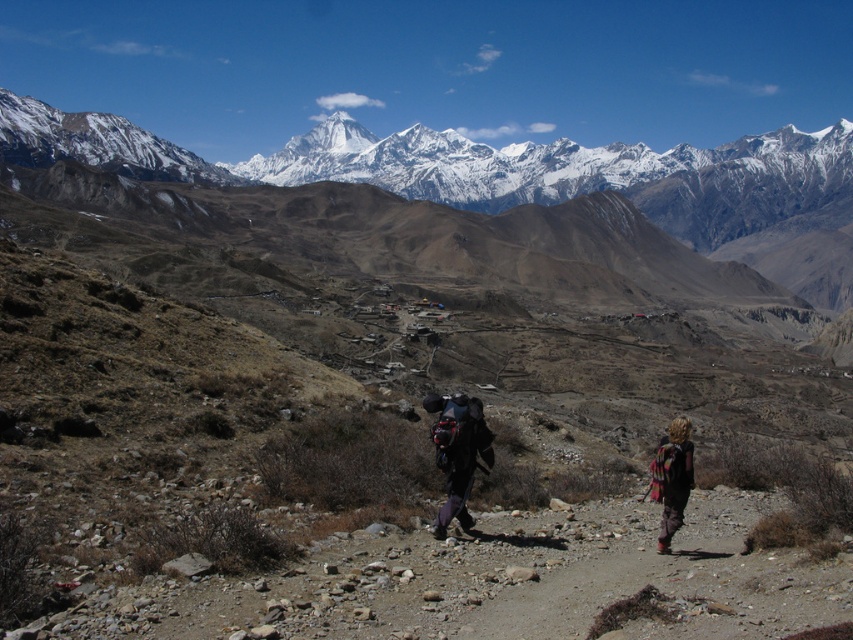
Does point (666, 536) come closer to viewer compared to point (682, 474)?

Yes, it is in front of point (682, 474).

Who is higher up, dark gray backpack at center or multicolored woven blanket at lower right?

dark gray backpack at center is higher up.

You are a GUI agent. You are given a task and a screenshot of the screen. Output one action in this format:
    pyautogui.click(x=<x>, y=<y>)
    Task: Click on the dark gray backpack at center
    
    Given the screenshot: What is the action you would take?
    pyautogui.click(x=457, y=451)

Who is shorter, matte black backpack at center or multicolored woven blanket at lower right?

multicolored woven blanket at lower right

Who is more distant from viewer, (432, 406) or (660, 532)?

The point (432, 406) is behind.

Who is more distant from viewer, [465,496] or [660,545]?

The point [465,496] is more distant.

Where is `matte black backpack at center`? This screenshot has width=853, height=640. matte black backpack at center is located at coordinates (457, 452).

Is dark gray backpack at center smaller than matte black backpack at center?

Actually, dark gray backpack at center might be larger than matte black backpack at center.

Where is `dark gray backpack at center`? dark gray backpack at center is located at coordinates (457, 451).